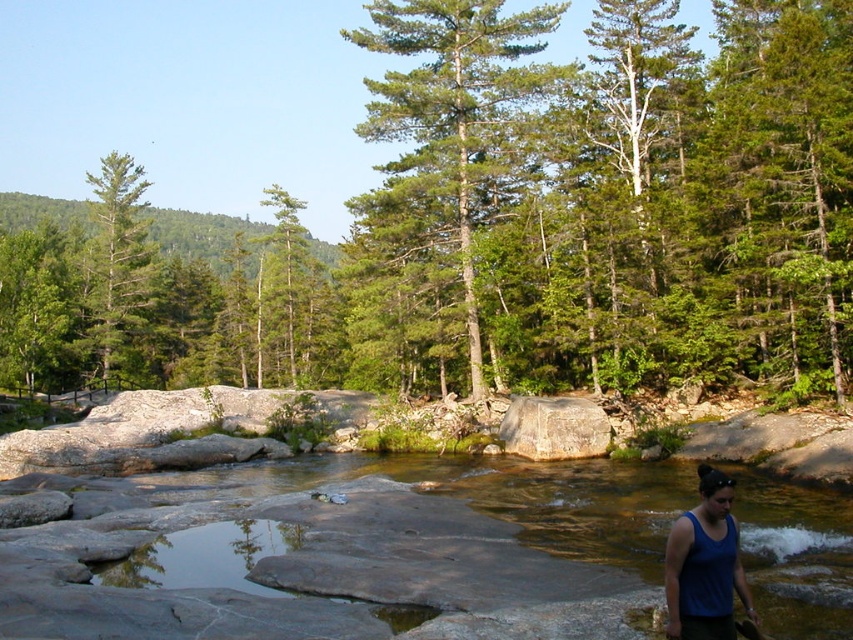
You are standing at the point marked by point (x=445, y=129) in the image, which is located at the center. What type of tree is directly in front of you?

The point (x=445, y=129) marks a green textured tree at center, so the tree directly in front of you is the green textured tree at center.

You are standing at the edge of the river and see the green matte tree at center and the clear water at center. Which object is located to the right of the other?

The clear water at center is to the right of the green matte tree at center because the green matte tree at center is positioned on the left side of clear water at center.